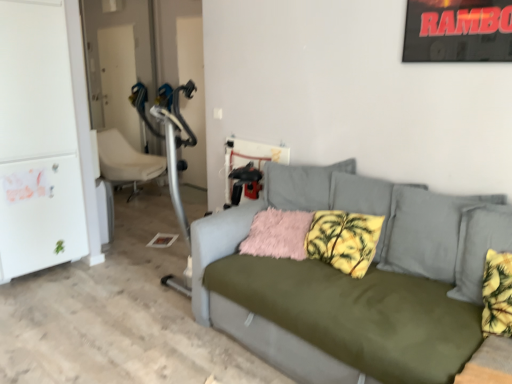
Question: Does yellow palm-patterned pillow at center, arranged as the first pillow when viewed from the right, have a lesser width compared to white matte refrigerator at left?

Choices:
 (A) yes
 (B) no

Answer: (A)

Question: From the image's perspective, does yellow palm-patterned pillow at center, arranged as the first pillow when viewed from the right, appear higher than white matte refrigerator at left?

Choices:
 (A) yes
 (B) no

Answer: (B)

Question: Considering the relative sizes of yellow palm-patterned pillow at center, the 2th pillow from the left, and white matte refrigerator at left in the image provided, is yellow palm-patterned pillow at center, the 2th pillow from the left, bigger than white matte refrigerator at left?

Choices:
 (A) no
 (B) yes

Answer: (A)

Question: Is yellow palm-patterned pillow at center, the 2th pillow from the left, positioned in front of white matte refrigerator at left?

Choices:
 (A) yes
 (B) no

Answer: (A)

Question: Is yellow palm-patterned pillow at center, the 2th pillow from the left, with white matte refrigerator at left?

Choices:
 (A) yes
 (B) no

Answer: (B)

Question: Can you confirm if yellow palm-patterned pillow at center, the 2th pillow from the left, is smaller than white matte refrigerator at left?

Choices:
 (A) no
 (B) yes

Answer: (B)

Question: Is fuzzy pink pillow at center, the second pillow when ordered from right to left, taller than yellow palm-patterned pillow at center, the 2th pillow from the left?

Choices:
 (A) no
 (B) yes

Answer: (A)

Question: From a real-world perspective, is fuzzy pink pillow at center, the second pillow when ordered from right to left, physically below yellow palm-patterned pillow at center, the 2th pillow from the left?

Choices:
 (A) no
 (B) yes

Answer: (B)

Question: Can you see fuzzy pink pillow at center, which is the 1th pillow in left-to-right order, touching yellow palm-patterned pillow at center, the 2th pillow from the left?

Choices:
 (A) yes
 (B) no

Answer: (B)

Question: Is fuzzy pink pillow at center, the second pillow when ordered from right to left, wider than yellow palm-patterned pillow at center, arranged as the first pillow when viewed from the right?

Choices:
 (A) no
 (B) yes

Answer: (B)

Question: Does fuzzy pink pillow at center, the second pillow when ordered from right to left, have a lesser width compared to yellow palm-patterned pillow at center, the 2th pillow from the left?

Choices:
 (A) no
 (B) yes

Answer: (A)

Question: Is fuzzy pink pillow at center, which is the 1th pillow in left-to-right order, facing away from yellow palm-patterned pillow at center, arranged as the first pillow when viewed from the right?

Choices:
 (A) no
 (B) yes

Answer: (A)

Question: Does white plastic chair at left contain fuzzy pink pillow at center, which is the 1th pillow in left-to-right order?

Choices:
 (A) yes
 (B) no

Answer: (B)